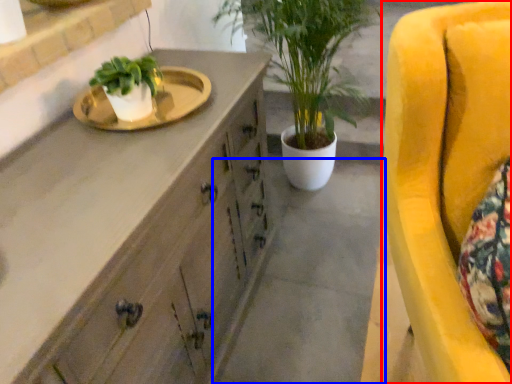
Question: Which of the following is the closest to the observer, chair (highlighted by a red box) or concrete (highlighted by a blue box)?

Choices:
 (A) chair
 (B) concrete

Answer: (A)